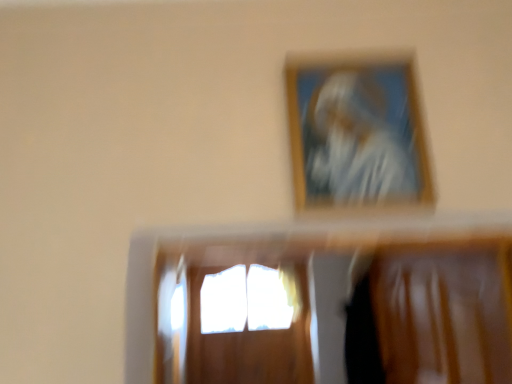
Locate an element on the screen. This screenshot has height=384, width=512. wooden picture frame at upper center is located at coordinates (357, 136).

What do you see at coordinates (357, 136) in the screenshot?
I see `wooden picture frame at upper center` at bounding box center [357, 136].

Describe the element at coordinates (233, 312) in the screenshot. I see `translucent glass window at center` at that location.

The image size is (512, 384). In order to click on translucent glass window at center in this screenshot , I will do `click(233, 312)`.

Locate an element on the screen. This screenshot has height=384, width=512. wooden picture frame at upper center is located at coordinates (357, 136).

Is wooden picture frame at upper center at the left side of translucent glass window at center?

No, wooden picture frame at upper center is not to the left of translucent glass window at center.

Which is in front, wooden picture frame at upper center or translucent glass window at center?

wooden picture frame at upper center is more forward.

Which is closer, (399, 116) or (298, 364)?

Point (399, 116)

From the image's perspective, does wooden picture frame at upper center appear higher than translucent glass window at center?

Indeed, from the image's perspective, wooden picture frame at upper center is shown above translucent glass window at center.

From a real-world perspective, who is located higher, wooden picture frame at upper center or translucent glass window at center?

From a 3D spatial view, wooden picture frame at upper center is above.

In the scene shown: Can you confirm if wooden picture frame at upper center is thinner than translucent glass window at center?

Indeed, wooden picture frame at upper center has a lesser width compared to translucent glass window at center.

Who is shorter, wooden picture frame at upper center or translucent glass window at center?

With less height is wooden picture frame at upper center.

In terms of size, does wooden picture frame at upper center appear bigger or smaller than translucent glass window at center?

Considering their sizes, wooden picture frame at upper center takes up less space than translucent glass window at center.

Is wooden picture frame at upper center located outside translucent glass window at center?

wooden picture frame at upper center lies outside translucent glass window at center's area.

Is the surface of wooden picture frame at upper center in direct contact with translucent glass window at center?

No.

Is wooden picture frame at upper center oriented towards translucent glass window at center?

No, wooden picture frame at upper center does not turn towards translucent glass window at center.

Can you tell me how much wooden picture frame at upper center and translucent glass window at center differ in facing direction?

1.82 degrees separate the facing orientations of wooden picture frame at upper center and translucent glass window at center.

Find the location of a particular element. picture frame that is on the right side of translucent glass window at center is located at coordinates (357, 136).

In the image, is translucent glass window at center on the left side or the right side of wooden picture frame at upper center?

translucent glass window at center is to the left of wooden picture frame at upper center.

Consider the image. Between translucent glass window at center and wooden picture frame at upper center, which one is positioned behind?

Positioned behind is translucent glass window at center.

Is point (233, 354) positioned in front of point (362, 125)?

No, it is not.

From the image's perspective, is translucent glass window at center on top of wooden picture frame at upper center?

No, from the image's perspective, translucent glass window at center is not on top of wooden picture frame at upper center.

From a real-world perspective, is translucent glass window at center positioned under wooden picture frame at upper center based on gravity?

Yes, from a real-world perspective, translucent glass window at center is below wooden picture frame at upper center.

Which of these two, translucent glass window at center or wooden picture frame at upper center, is thinner?

wooden picture frame at upper center.

Considering the relative sizes of translucent glass window at center and wooden picture frame at upper center in the image provided, is translucent glass window at center shorter than wooden picture frame at upper center?

In fact, translucent glass window at center may be taller than wooden picture frame at upper center.

Is translucent glass window at center bigger or smaller than wooden picture frame at upper center?

Considering their sizes, translucent glass window at center takes up more space than wooden picture frame at upper center.

Is wooden picture frame at upper center located within translucent glass window at center?

Actually, wooden picture frame at upper center is outside translucent glass window at center.

Does translucent glass window at center touch wooden picture frame at upper center?

No, translucent glass window at center is not in contact with wooden picture frame at upper center.

Is translucent glass window at center facing away from wooden picture frame at upper center?

No, translucent glass window at center is not facing away from wooden picture frame at upper center.

How different are the orientations of translucent glass window at center and wooden picture frame at upper center in degrees?

There is a 1.82-degree angle between the facing directions of translucent glass window at center and wooden picture frame at upper center.

Where is `window on the left of wooden picture frame at upper center`? The height and width of the screenshot is (384, 512). window on the left of wooden picture frame at upper center is located at coordinates (233, 312).

In the image, there is a wooden picture frame at upper center. Identify the location of window below it (from a real-world perspective). Image resolution: width=512 pixels, height=384 pixels. (233, 312).

You are a GUI agent. You are given a task and a screenshot of the screen. Output one action in this format:
    pyautogui.click(x=<x>, y=<y>)
    Task: Click on the window that is below the wooden picture frame at upper center (from the image's perspective)
    This screenshot has width=512, height=384.
    Given the screenshot: What is the action you would take?
    pyautogui.click(x=233, y=312)